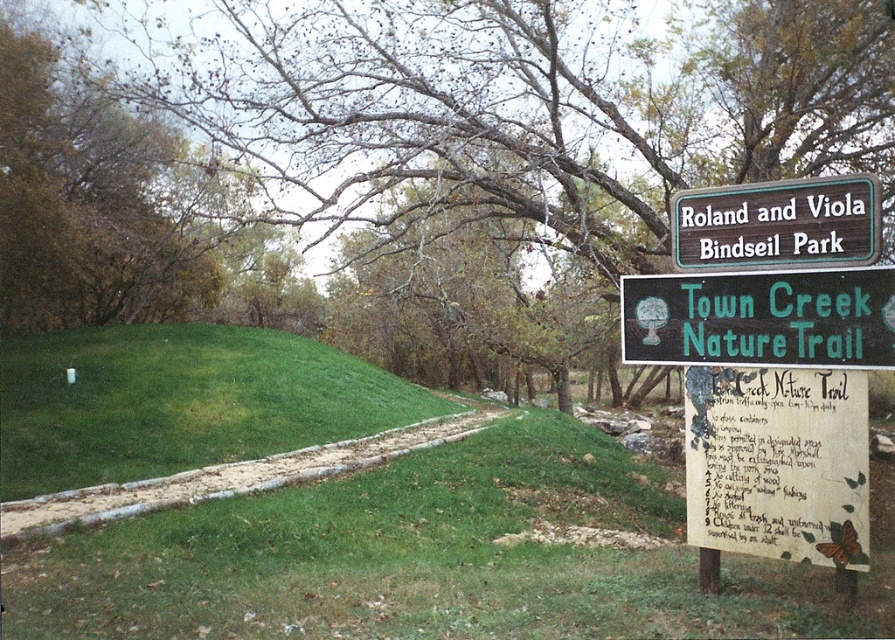
Question: Among these objects, which one is nearest to the camera?

Choices:
 (A) green wooden sign at upper center
 (B) white paper sign at right

Answer: (B)

Question: Is green grassy hillside at lower left bigger than green wooden sign at upper center?

Choices:
 (A) yes
 (B) no

Answer: (A)

Question: Does green grassy hillside at lower left appear under green plastic sign at right?

Choices:
 (A) yes
 (B) no

Answer: (A)

Question: Can you confirm if white paper sign at right is positioned above green plastic sign at right?

Choices:
 (A) yes
 (B) no

Answer: (B)

Question: Which object appears farthest from the camera in this image?

Choices:
 (A) green grassy hillside at lower left
 (B) white paper sign at right
 (C) green wooden sign at upper center

Answer: (A)

Question: Among these points, which one is nearest to the camera?

Choices:
 (A) (695, 193)
 (B) (706, 442)
 (C) (24, 372)

Answer: (B)